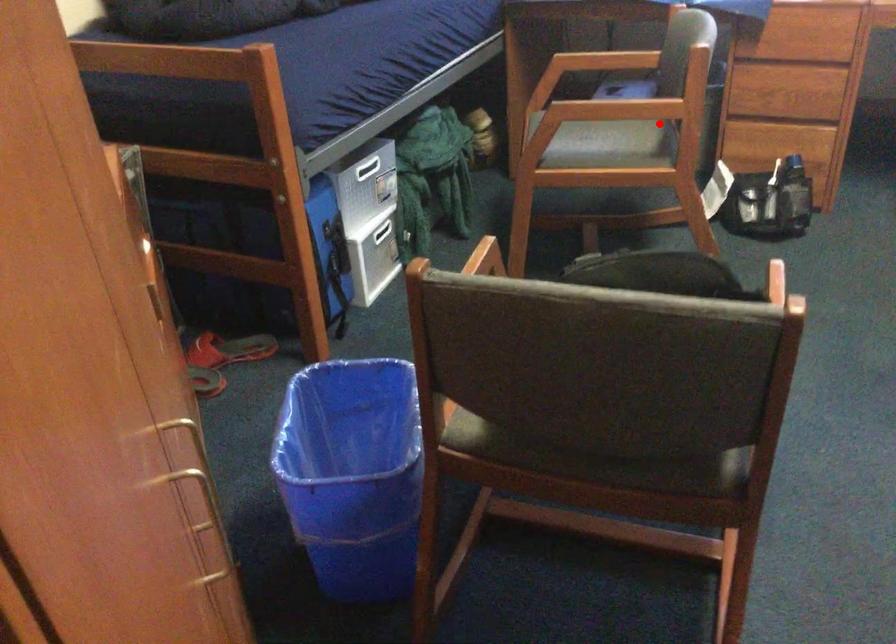
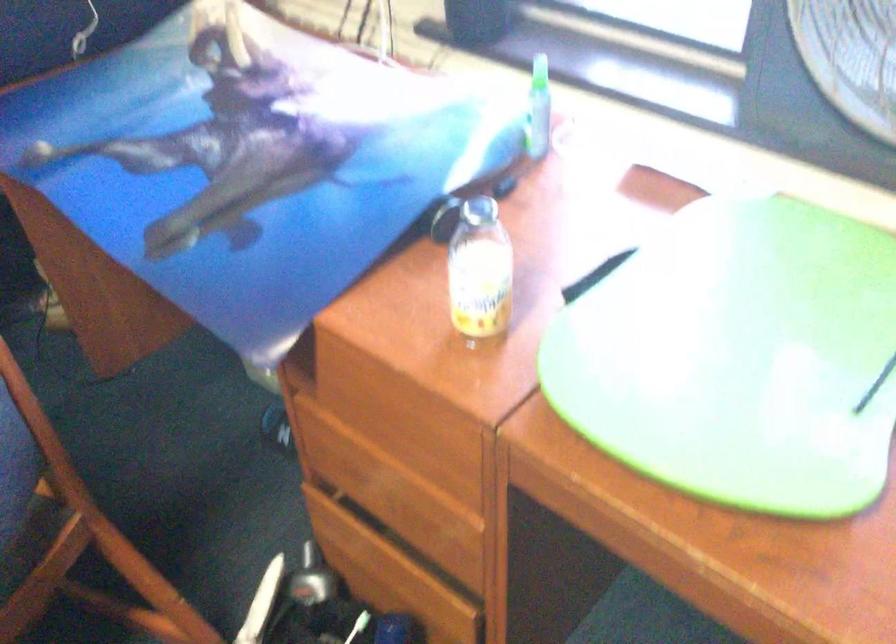
In the second image, find the point that corresponds to the highlighted location in the first image.

(30, 540)